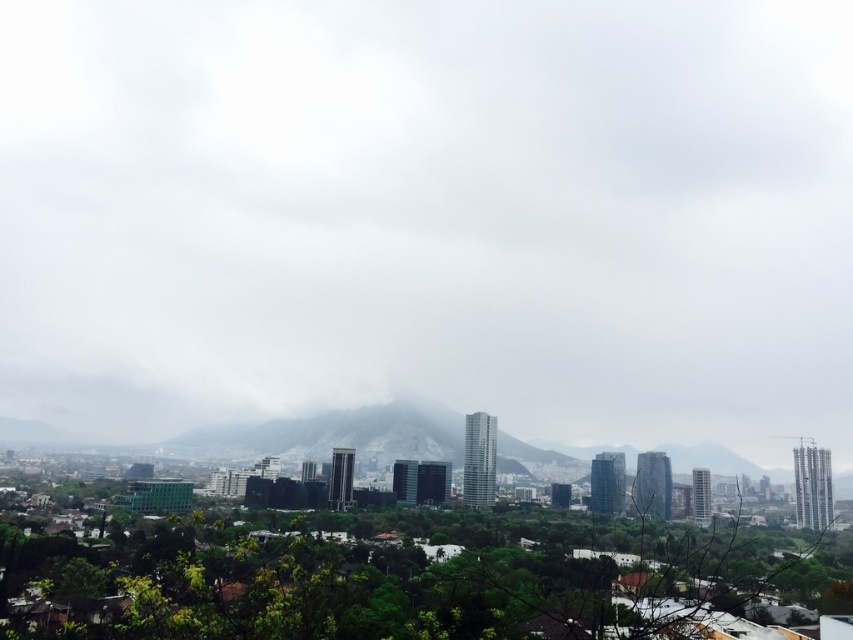
Question: In this image, where is white fluffy cloud at center located relative to gray foggy mountain at center?

Choices:
 (A) below
 (B) above

Answer: (B)

Question: From the image, what is the correct spatial relationship of white fluffy cloud at center in relation to gray foggy mountain at center?

Choices:
 (A) left
 (B) right

Answer: (B)

Question: Is white fluffy cloud at center behind gray foggy mountain at center?

Choices:
 (A) yes
 (B) no

Answer: (A)